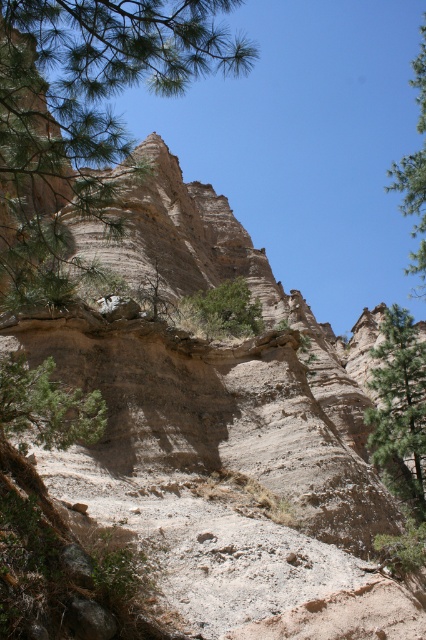
Between point (176, 81) and point (2, 381), which one is positioned in front?

Positioned in front is point (176, 81).

Is green leafy tree at upper left below green textured tree at lower left?

No.

What do you see at coordinates (83, 113) in the screenshot? I see `green leafy tree at upper left` at bounding box center [83, 113].

Find the location of a particular element. The height and width of the screenshot is (640, 426). green leafy tree at upper left is located at coordinates tap(83, 113).

Where is `green textured tree at lower left`? This screenshot has width=426, height=640. green textured tree at lower left is located at coordinates (46, 406).

Who is higher up, green textured tree at lower left or green leafy shrub at center?

Positioned higher is green leafy shrub at center.

This screenshot has width=426, height=640. Describe the element at coordinates (46, 406) in the screenshot. I see `green textured tree at lower left` at that location.

This screenshot has height=640, width=426. What are the coordinates of `green textured tree at lower left` in the screenshot? It's located at (46, 406).

Who is taller, green leafy tree at upper right or green leafy shrub at center?

green leafy tree at upper right is taller.

Does green leafy tree at upper right appear on the right side of green leafy shrub at center?

Correct, you'll find green leafy tree at upper right to the right of green leafy shrub at center.

What do you see at coordinates (412, 205) in the screenshot? The width and height of the screenshot is (426, 640). I see `green leafy tree at upper right` at bounding box center [412, 205].

At what (x,y) coordinates should I click in order to perform the action: click on green leafy tree at upper right. Please return your answer as a coordinate pair (x, y). This screenshot has width=426, height=640. Looking at the image, I should click on (412, 205).